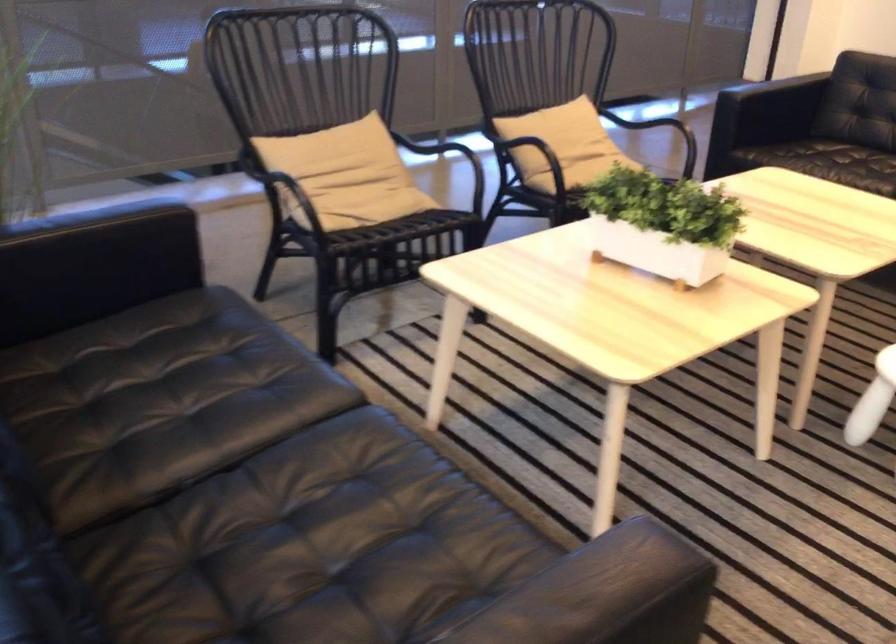
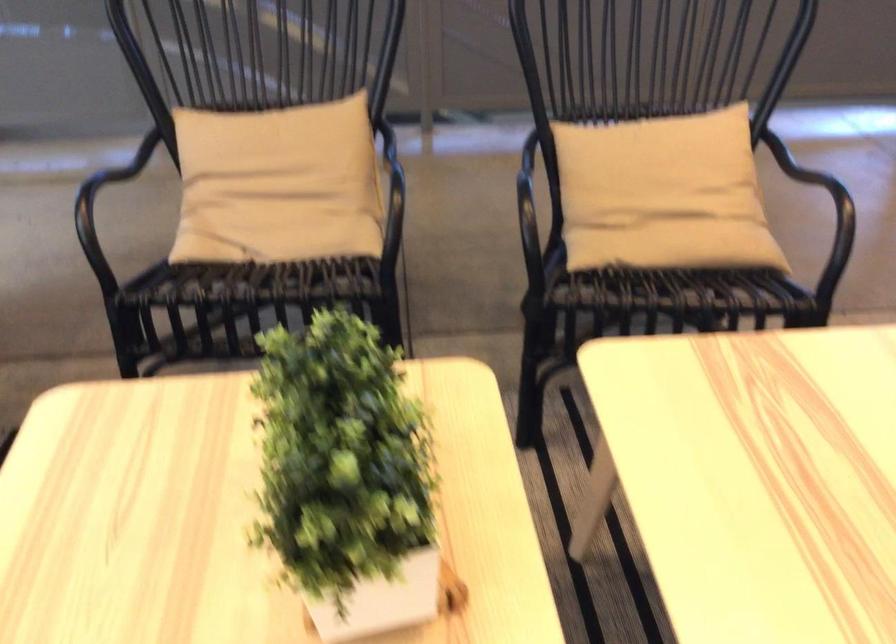
Locate, in the second image, the point that corresponds to (340,176) in the first image.

(278, 184)